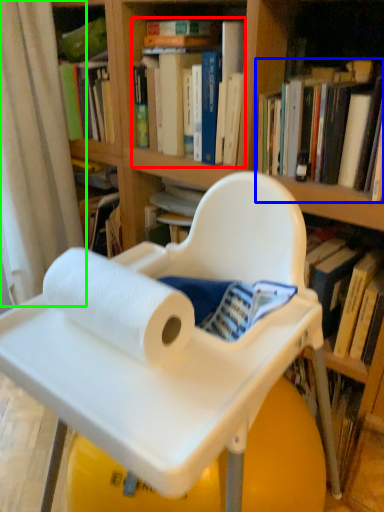
Question: Which object is positioned farthest from book (highlighted by a red box)? Select from book (highlighted by a blue box) and curtain (highlighted by a green box).

Choices:
 (A) book
 (B) curtain

Answer: (B)